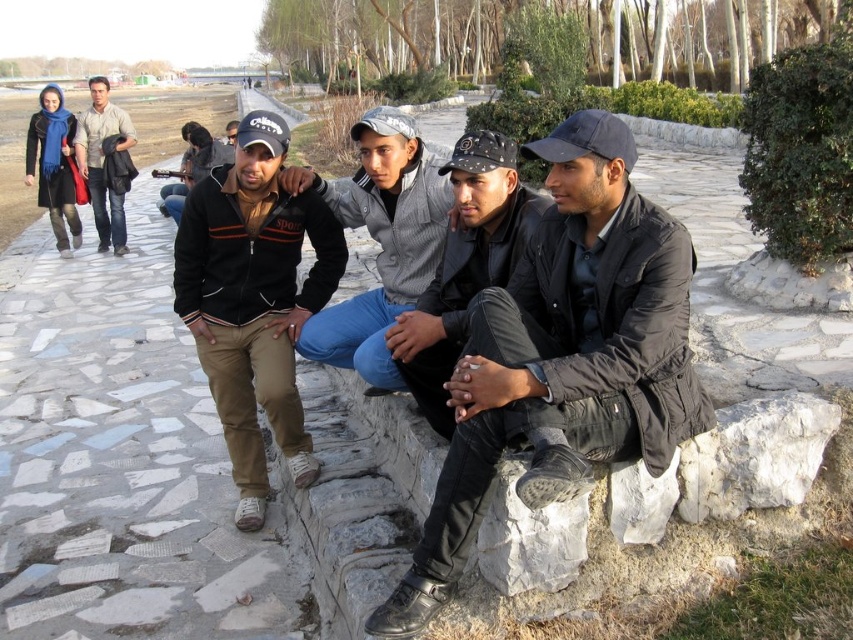
Question: Is black cotton jacket at center below gray knit sweater at center?

Choices:
 (A) no
 (B) yes

Answer: (B)

Question: Which of the following is the closest to the observer?

Choices:
 (A) black cotton jacket at center
 (B) dark gray leather jacket at center
 (C) matte beige jacket at upper left

Answer: (B)

Question: Estimate the real-world distances between objects in this image. Which object is closer to the gray knit sweater at center?

Choices:
 (A) black cotton jacket at center
 (B) matte beige jacket at upper left
 (C) black leather jacket at center
 (D) dark gray leather jacket at center

Answer: (C)

Question: Can you confirm if black cotton jacket at center is positioned above black leather jacket at center?

Choices:
 (A) no
 (B) yes

Answer: (A)

Question: Is dark gray leather jacket at center in front of matte beige jacket at upper left?

Choices:
 (A) yes
 (B) no

Answer: (A)

Question: Considering the real-world distances, which object is farthest from the gray knit sweater at center?

Choices:
 (A) black leather jacket at center
 (B) dark gray leather jacket at center

Answer: (B)